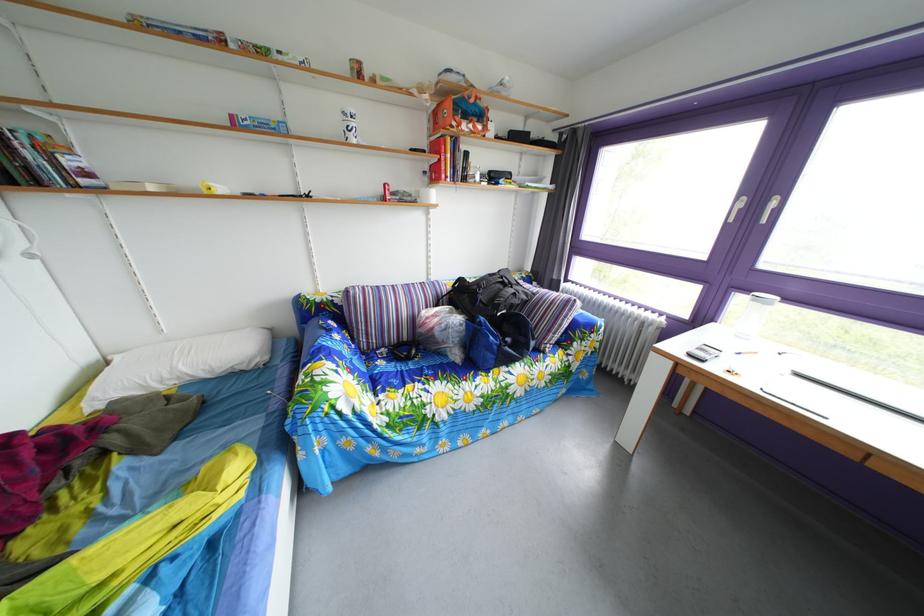
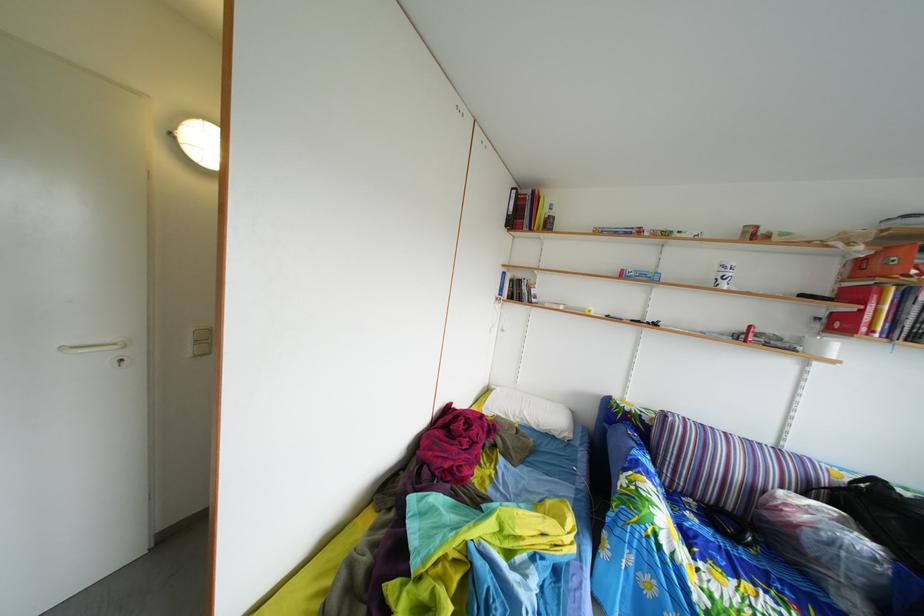
Where in the second image is the point corresponding to (x=223, y=379) from the first image?

(549, 434)